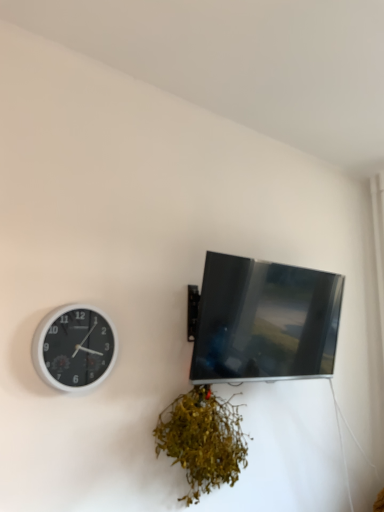
The height and width of the screenshot is (512, 384). What do you see at coordinates (74, 347) in the screenshot?
I see `white plastic wall clock at left` at bounding box center [74, 347].

What do you see at coordinates (203, 440) in the screenshot? This screenshot has height=512, width=384. I see `green leafy plant at lower center` at bounding box center [203, 440].

Find the location of a particular element. matte black tv at upper right is located at coordinates (265, 321).

Do you think matte black tv at upper right is within white plastic wall clock at left, or outside of it?

matte black tv at upper right is not enclosed by white plastic wall clock at left.

Is matte black tv at upper right taller than white plastic wall clock at left?

Yes, matte black tv at upper right is taller than white plastic wall clock at left.

Are matte black tv at upper right and white plastic wall clock at left beside each other?

They are not placed beside each other.

Is the depth of matte black tv at upper right less than that of white plastic wall clock at left?

No, it is behind white plastic wall clock at left.

Is point (233, 436) closer or farther from the camera than point (84, 324)?

Clearly, point (233, 436) is more distant from the camera than point (84, 324).

From a real-world perspective, relative to white plastic wall clock at left, is green leafy plant at lower center vertically above or below?

Clearly, from a real-world perspective, green leafy plant at lower center is below white plastic wall clock at left.

Is green leafy plant at lower center positioned far away from white plastic wall clock at left?

No, green leafy plant at lower center is in close proximity to white plastic wall clock at left.

Which is more to the left, green leafy plant at lower center or white plastic wall clock at left?

Positioned to the left is white plastic wall clock at left.

Looking at this image, in terms of size, does white plastic wall clock at left appear bigger or smaller than matte black tv at upper right?

Clearly, white plastic wall clock at left is smaller in size than matte black tv at upper right.

Consider the image. Which object is thinner, white plastic wall clock at left or matte black tv at upper right?

With smaller width is white plastic wall clock at left.

What are the coordinates of `television above the white plastic wall clock at left (from the image's perspective)` in the screenshot? It's located at (265, 321).

Is white plastic wall clock at left shorter than matte black tv at upper right?

Yes.

Where is `wall clock above the green leafy plant at lower center (from a real-world perspective)`? wall clock above the green leafy plant at lower center (from a real-world perspective) is located at coordinates (74, 347).

From the image's perspective, which is above, white plastic wall clock at left or green leafy plant at lower center?

white plastic wall clock at left.

Would you say green leafy plant at lower center is part of white plastic wall clock at left's contents?

Actually, green leafy plant at lower center is outside white plastic wall clock at left.

From a real-world perspective, is matte black tv at upper right beneath green leafy plant at lower center?

No.

Does matte black tv at upper right touch green leafy plant at lower center?

No, matte black tv at upper right is not next to green leafy plant at lower center.

Is matte black tv at upper right to the left of green leafy plant at lower center from the viewer's perspective?

No.

From the image's perspective, relative to green leafy plant at lower center, is matte black tv at upper right above or below?

From the image's perspective, matte black tv at upper right appears above green leafy plant at lower center.

Is green leafy plant at lower center aimed at matte black tv at upper right?

No, green leafy plant at lower center does not turn towards matte black tv at upper right.

Is green leafy plant at lower center shorter than matte black tv at upper right?

Yes, green leafy plant at lower center is shorter than matte black tv at upper right.

Considering the relative sizes of green leafy plant at lower center and matte black tv at upper right in the image provided, is green leafy plant at lower center bigger than matte black tv at upper right?

No, green leafy plant at lower center is not bigger than matte black tv at upper right.

Is there a large distance between green leafy plant at lower center and matte black tv at upper right?

green leafy plant at lower center is actually quite close to matte black tv at upper right.

What are the coordinates of `wall clock that appears in front of the matte black tv at upper right` in the screenshot? It's located at (74, 347).

This screenshot has height=512, width=384. I want to click on houseplant located underneath the white plastic wall clock at left (from a real-world perspective), so click(x=203, y=440).

Which object lies nearer to the anchor point matte black tv at upper right, white plastic wall clock at left or green leafy plant at lower center?

The object closer to matte black tv at upper right is green leafy plant at lower center.

In the scene shown: Based on their spatial positions, is white plastic wall clock at left or matte black tv at upper right further from green leafy plant at lower center?

white plastic wall clock at left lies further to green leafy plant at lower center than the other object.

Which object lies further to the anchor point white plastic wall clock at left, matte black tv at upper right or green leafy plant at lower center?

Based on the image, matte black tv at upper right appears to be further to white plastic wall clock at left.

Considering their positions, is matte black tv at upper right positioned further to green leafy plant at lower center than white plastic wall clock at left?

white plastic wall clock at left is positioned further to the anchor green leafy plant at lower center.

Estimate the real-world distances between objects in this image. Which object is closer to matte black tv at upper right, green leafy plant at lower center or white plastic wall clock at left?

green leafy plant at lower center lies closer to matte black tv at upper right than the other object.

Consider the image. Considering their positions, is green leafy plant at lower center positioned closer to white plastic wall clock at left than matte black tv at upper right?

green leafy plant at lower center lies closer to white plastic wall clock at left than the other object.

Image resolution: width=384 pixels, height=512 pixels. In order to click on houseplant between white plastic wall clock at left and matte black tv at upper right in the horizontal direction in this screenshot , I will do pos(203,440).